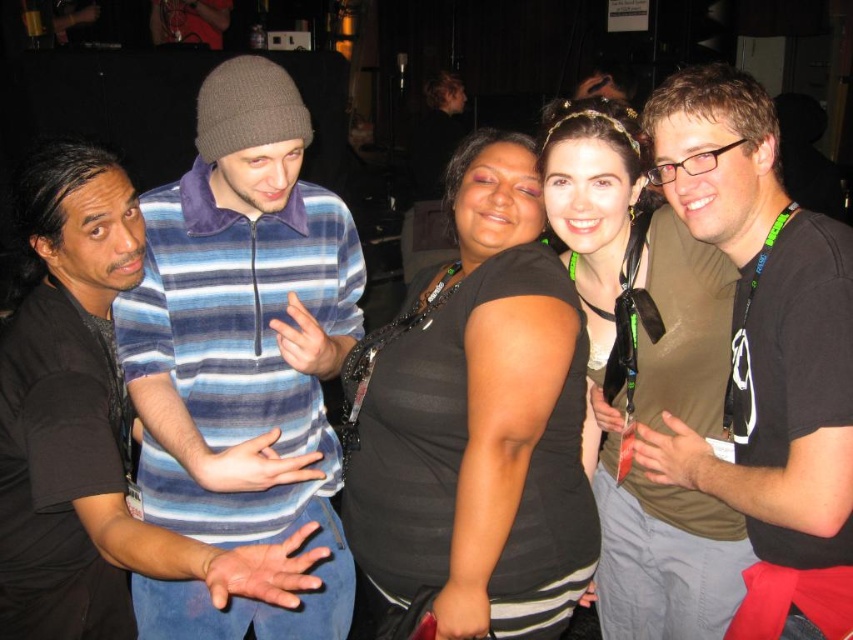
You are at a social event and see two people in the image. The first person is wearing a striped cotton shirt at left, and the second is wearing a matte black shirt at right. Which person is standing closer to the ceiling?

The striped cotton shirt at left is taller than the matte black shirt at right, so the person wearing the striped cotton shirt at left is standing closer to the ceiling.

You are at a social event and want to approach the person wearing the matte black shirt at right. Since there are people in between, can you walk directly to them without moving around the striped cotton shirt at left?

The matte black shirt at right is behind the striped cotton shirt at left, so you would need to move around the striped cotton shirt at left to reach the matte black shirt at right.

You are standing in the dimly lit indoor venue and need to locate the striped cotton shirt at left. Based on the coordinates provided in the Objects Description, can you determine its position relative to the center of the image?

The striped cotton shirt at left is located at coordinates point (x=242, y=355). Since the coordinates are given as a point, the first value typically represents the horizontal axis and the second the vertical. A value of 0.555 on the horizontal axis is slightly to the right of center, and 0.285 on the vertical axis places it above the center. Therefore, the striped cotton shirt at left is positioned slightly right and above the center of the image.